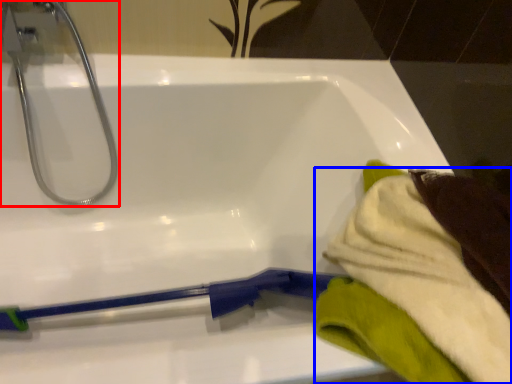
Question: Which object appears closest to the camera in this image, tap (highlighted by a red box) or bath towel (highlighted by a blue box)?

Choices:
 (A) tap
 (B) bath towel

Answer: (B)